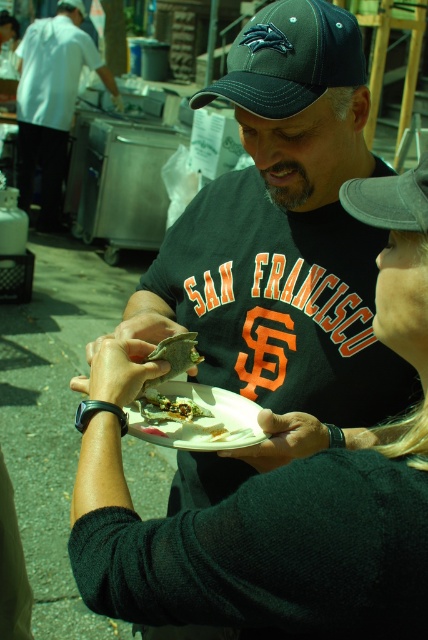
Question: Which of the following is the farthest from the observer?

Choices:
 (A) white paper plate at center
 (B) shiny metallic food at center

Answer: (B)

Question: Considering the real-world distances, which object is closest to the matte black plate at center?

Choices:
 (A) shiny metallic food at center
 (B) black fabric baseball cap at upper center

Answer: (A)

Question: Observing the image, what is the correct spatial positioning of white paper plate at center in reference to shiny metallic food at center?

Choices:
 (A) right
 (B) left

Answer: (A)

Question: Can you confirm if matte black shirt at center is positioned above green matte leaf at center?

Choices:
 (A) yes
 (B) no

Answer: (A)

Question: Is black fabric baseball cap at upper center bigger than green matte leaf at center?

Choices:
 (A) yes
 (B) no

Answer: (A)

Question: Which point is closer to the camera taking this photo?

Choices:
 (A) (148, 413)
 (B) (193, 428)
 (C) (273, 600)

Answer: (C)